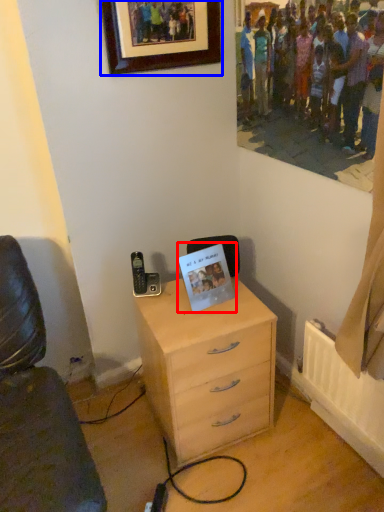
Question: Which of the following is the closest to the observer, postcard (highlighted by a red box) or picture frame (highlighted by a blue box)?

Choices:
 (A) postcard
 (B) picture frame

Answer: (B)